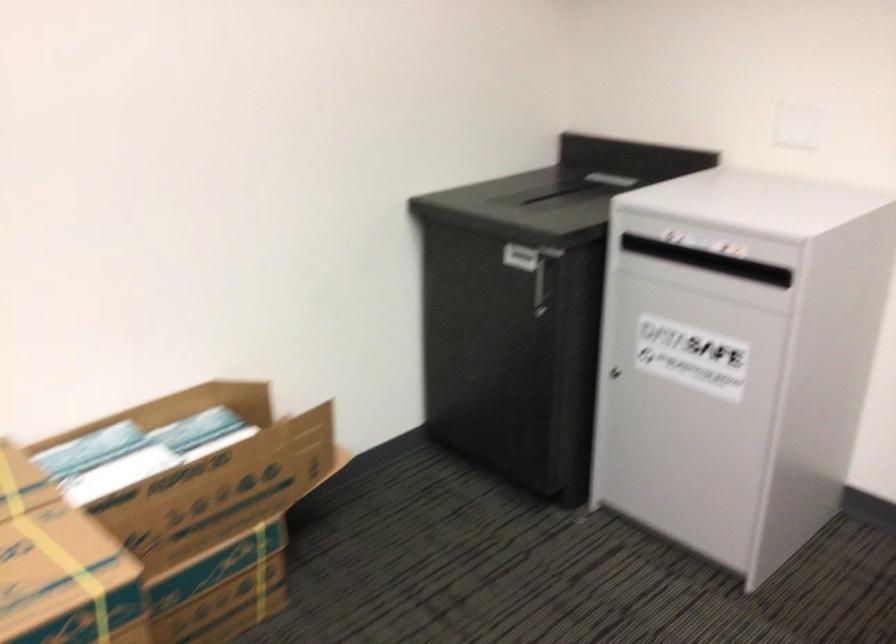
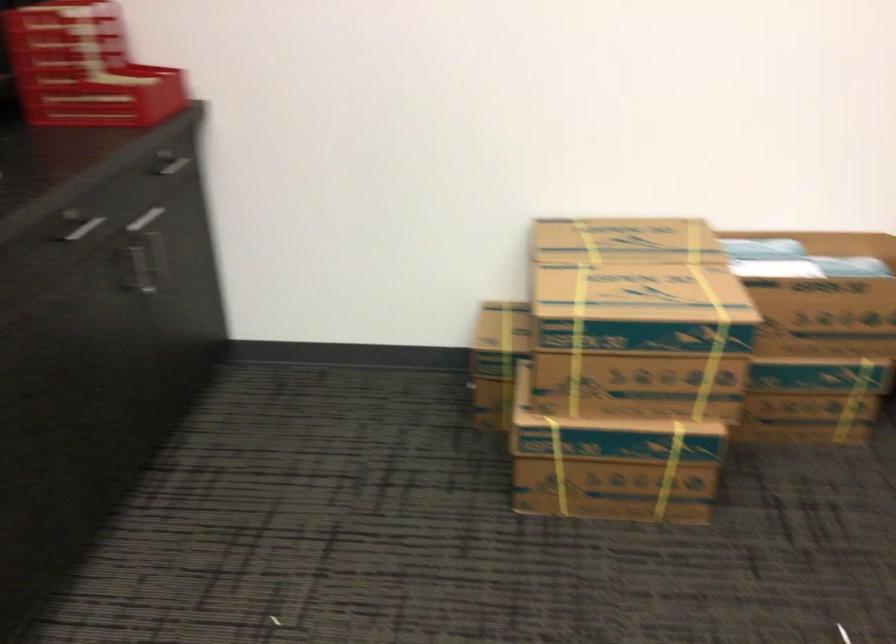
Question: The camera is either moving clockwise (left) or counter-clockwise (right) around the object. The first image is from the beginning of the video and the second image is from the end. Is the camera moving left or right when shooting the video?

Choices:
 (A) Left
 (B) Right

Answer: (B)